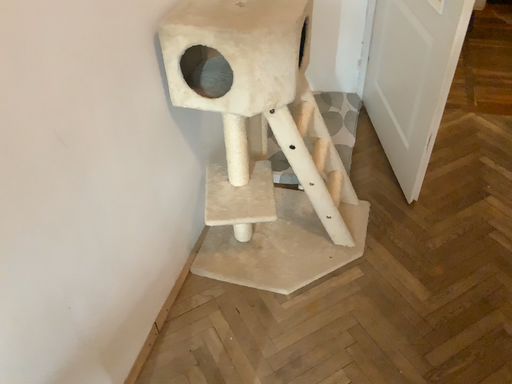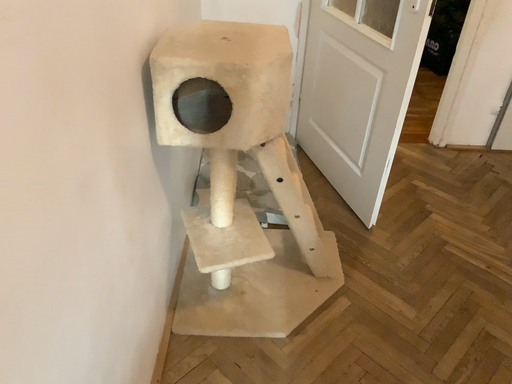
Question: Which way did the camera rotate in the video?

Choices:
 (A) rotated upward
 (B) rotated downward

Answer: (A)